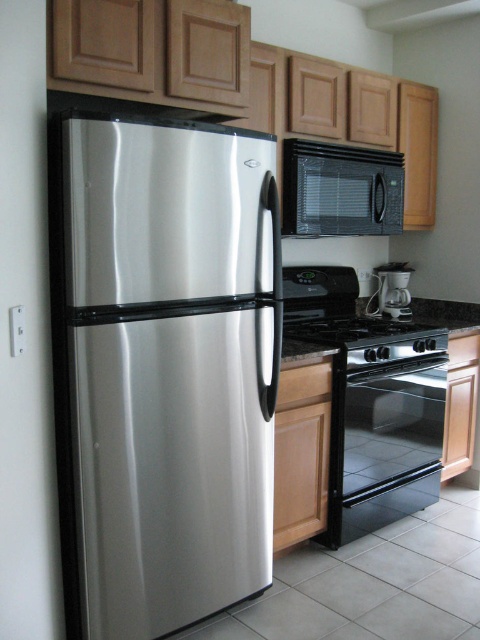
Can you confirm if stainless steel refrigerator at left is positioned to the left of white plastic coffee maker at center?

Indeed, stainless steel refrigerator at left is positioned on the left side of white plastic coffee maker at center.

Is point (233, 129) more distant than point (393, 301)?

No.

Between point (241, 292) and point (407, 308), which one is positioned behind?

Point (407, 308)

Locate an element on the screen. stainless steel refrigerator at left is located at coordinates (167, 371).

Is stainless steel refrigerator at left closer to camera compared to black glossy oven at lower center?

Yes.

Does point (127, 358) come farther from viewer compared to point (338, 362)?

No, it is in front of (338, 362).

Identify the location of stainless steel refrigerator at left. The height and width of the screenshot is (640, 480). (167, 371).

Who is more distant from viewer, (144, 365) or (371, 340)?

Point (371, 340)

Between stainless steel refrigerator at left and black glass stove at center, which one is positioned higher?

black glass stove at center is higher up.

Is point (76, 172) in front of point (420, 349)?

Yes.

Where is `stainless steel refrigerator at left`? This screenshot has width=480, height=640. stainless steel refrigerator at left is located at coordinates (167, 371).